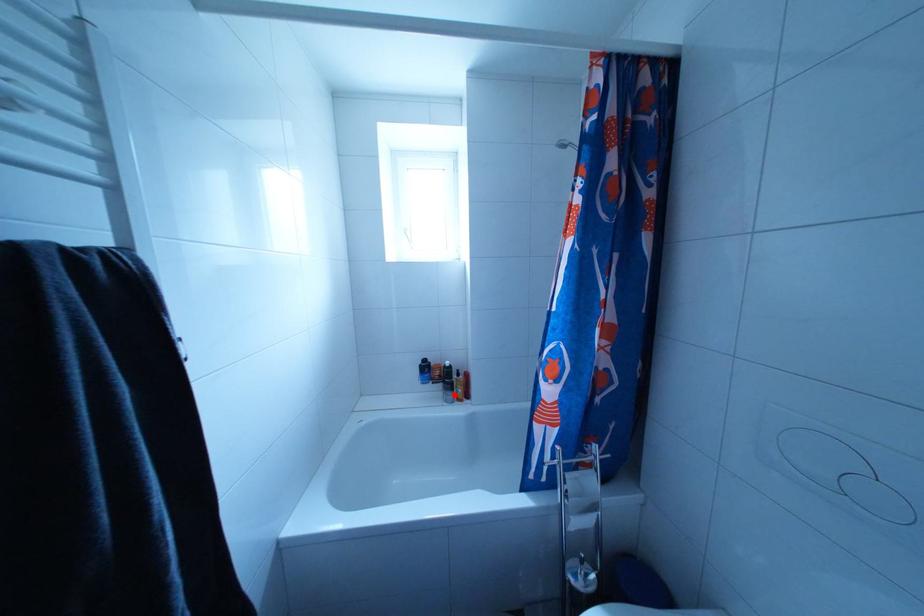
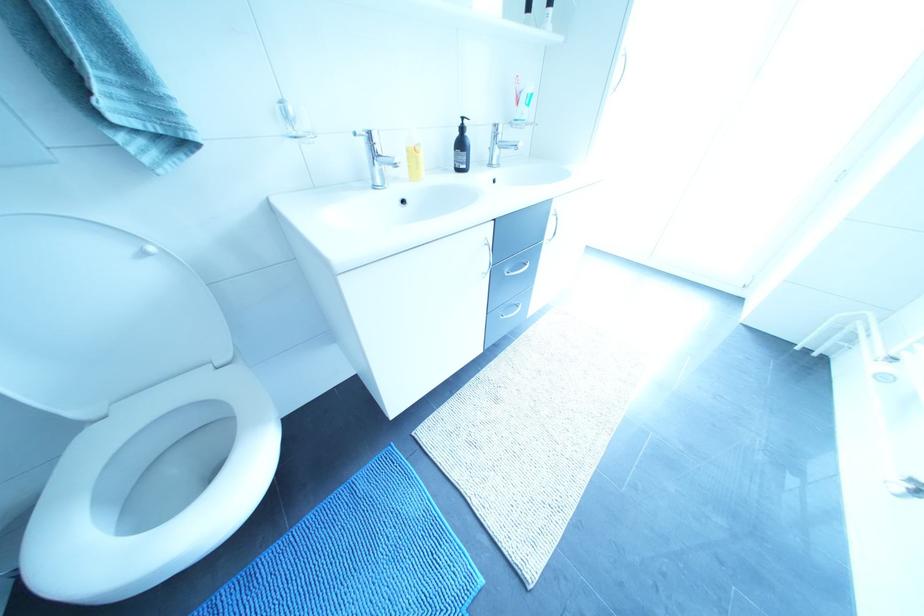
Question: I am providing you with two images of the same scene from different viewpoints. A red point is marked on the first image. Can you still see the location of the red point in image 2?

Choices:
 (A) Yes
 (B) No

Answer: (B)